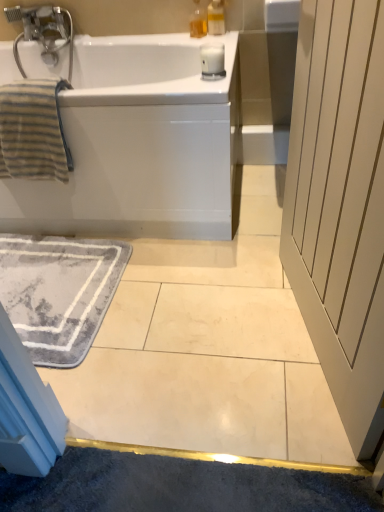
Question: Which direction should I rotate to face translucent plastic soap dispenser at upper center, which is counted as the 2th soap dispenser, starting from the right, — up or down?

Choices:
 (A) down
 (B) up

Answer: (B)

Question: Are white wood screen door at right and white glossy bathtub at upper left far apart?

Choices:
 (A) no
 (B) yes

Answer: (A)

Question: Can white glossy bathtub at upper left be found inside white wood screen door at right?

Choices:
 (A) yes
 (B) no

Answer: (B)

Question: Does white wood screen door at right have a lesser width compared to white glossy bathtub at upper left?

Choices:
 (A) no
 (B) yes

Answer: (B)

Question: Can you confirm if white wood screen door at right is bigger than white glossy bathtub at upper left?

Choices:
 (A) yes
 (B) no

Answer: (B)

Question: Is white wood screen door at right to the left of white glossy bathtub at upper left from the viewer's perspective?

Choices:
 (A) no
 (B) yes

Answer: (A)

Question: Can you confirm if white wood screen door at right is taller than white glossy bathtub at upper left?

Choices:
 (A) no
 (B) yes

Answer: (B)

Question: Are translucent plastic soap dispenser at upper center, the 1th soap dispenser from the right, and gray soft rug at lower left located far from each other?

Choices:
 (A) no
 (B) yes

Answer: (B)

Question: Can you confirm if translucent plastic soap dispenser at upper center, which is counted as the second soap dispenser, starting from the left, is smaller than gray soft rug at lower left?

Choices:
 (A) yes
 (B) no

Answer: (A)

Question: From the image's perspective, is translucent plastic soap dispenser at upper center, which is counted as the second soap dispenser, starting from the left, located above gray soft rug at lower left?

Choices:
 (A) yes
 (B) no

Answer: (A)

Question: Is translucent plastic soap dispenser at upper center, which is counted as the second soap dispenser, starting from the left, aimed at gray soft rug at lower left?

Choices:
 (A) no
 (B) yes

Answer: (A)

Question: Is translucent plastic soap dispenser at upper center, which is counted as the second soap dispenser, starting from the left, at the right side of gray soft rug at lower left?

Choices:
 (A) yes
 (B) no

Answer: (A)

Question: From the image's perspective, is translucent plastic soap dispenser at upper center, which is counted as the second soap dispenser, starting from the left, below gray soft rug at lower left?

Choices:
 (A) yes
 (B) no

Answer: (B)

Question: From a real-world perspective, is white glossy bathtub at upper left positioned under gray soft rug at lower left based on gravity?

Choices:
 (A) yes
 (B) no

Answer: (B)